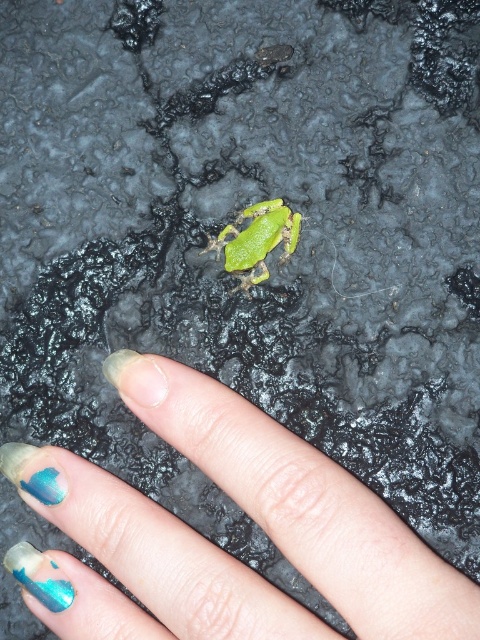
Looking at this image, can you confirm if teal painted nails at lower left is positioned above green matte/frosted frog at center?

Incorrect, teal painted nails at lower left is not positioned above green matte/frosted frog at center.

The image size is (480, 640). Describe the element at coordinates (302, 504) in the screenshot. I see `teal painted nails at lower left` at that location.

I want to click on teal painted nails at lower left, so click(x=302, y=504).